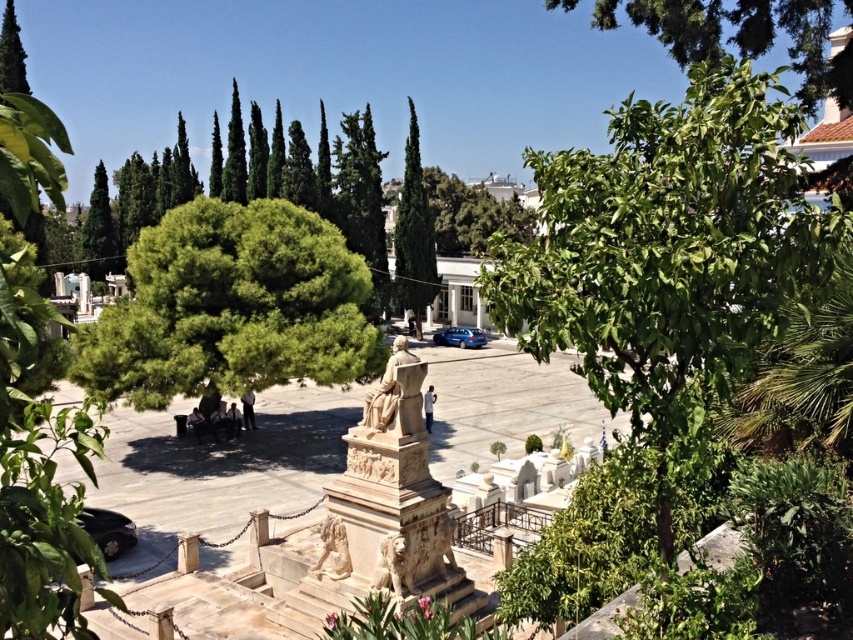
You are a visitor at the park and want to take a photo of the green textured tree at center and the satin blue sedan at center from the best angle. Which object should you stand closer to in order to capture both in the frame without moving your camera?

You should stand closer to the satin blue sedan at center because the green textured tree at center is on the left side of it, allowing both to be in the frame when positioned near the sedan.

You are a visitor at the park and want to take a photo of the green leafy tree at center without the satin blue sedan at center appearing in the shot. How can you adjust your position to achieve this?

Since the green leafy tree at center is positioned over the satin blue sedan at center, you can move to the side so that the tree is no longer directly above the sedan in your viewfinder, allowing you to capture the tree without the sedan appearing below it.

You are a photographer wanting to capture the green textured tree at center and the satin blue sedan at center in the same frame. Can you position yourself so that both are visible without one blocking the other?

The green textured tree at center is positioned over the satin blue sedan at center, so if you position yourself below the tree, you can see the sedan underneath it, allowing both to be visible in the frame.